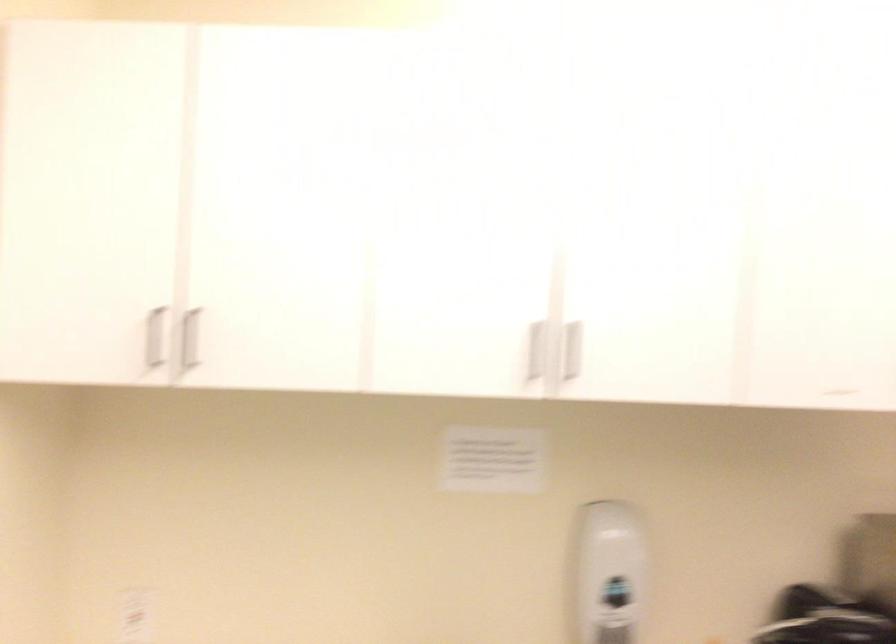
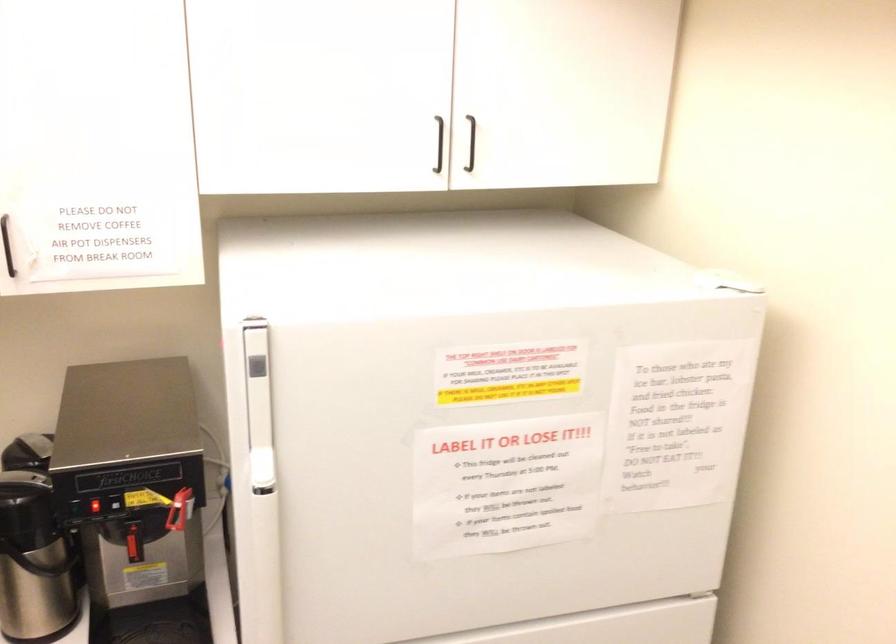
Question: What movement of the cameraman would produce the second image?

Choices:
 (A) Left
 (B) Right
 (C) Forward
 (D) Backward

Answer: (B)